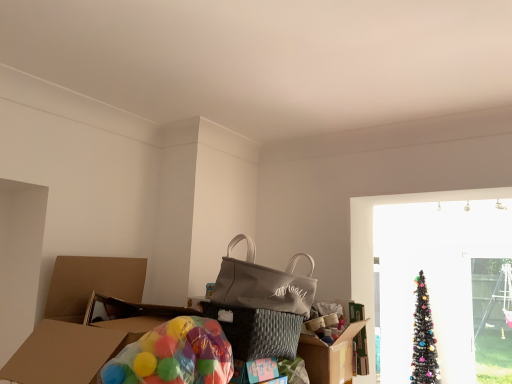
Question: Does point (172, 337) appear closer or farther from the camera than point (236, 238)?

Choices:
 (A) closer
 (B) farther

Answer: (A)

Question: Relative to matte gray tote bag at center, is translucent plastic balloons at lower left in front or behind?

Choices:
 (A) front
 (B) behind

Answer: (A)

Question: Which object is the farthest from the translucent plastic balloons at lower left?

Choices:
 (A) black glittery christmas tree at right
 (B) matte gray tote bag at center
 (C) transparent plastic screen door at right

Answer: (C)

Question: Estimate the real-world distances between objects in this image. Which object is closer to the matte gray tote bag at center?

Choices:
 (A) translucent plastic balloons at lower left
 (B) transparent plastic screen door at right
 (C) black glittery christmas tree at right

Answer: (A)